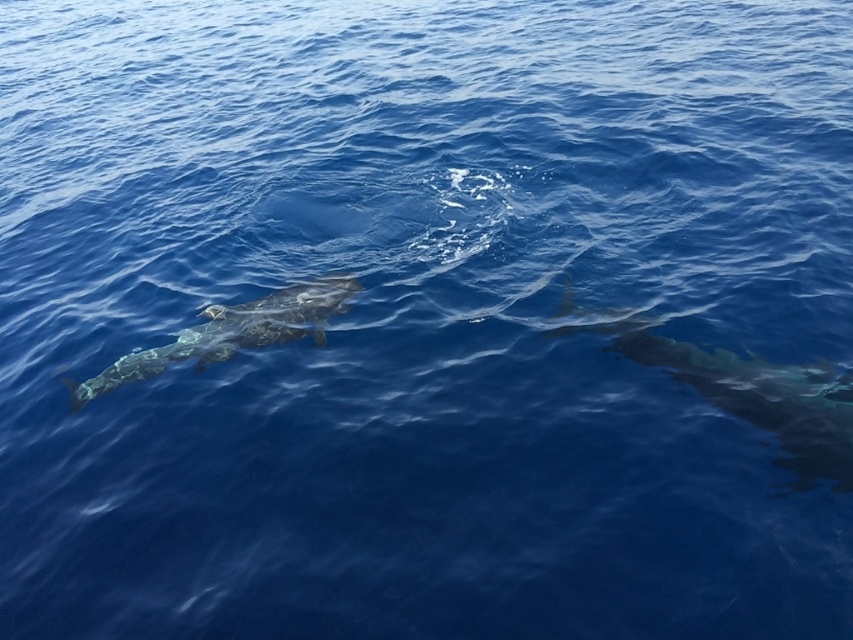
Is shiny dark gray whale at right to the left of smooth gray whale at left from the viewer's perspective?

Result: No, shiny dark gray whale at right is not to the left of smooth gray whale at left.

Between point (670, 355) and point (74, 394), which one is positioned behind?

Positioned behind is point (74, 394).

Where is `shiny dark gray whale at right`? The width and height of the screenshot is (853, 640). shiny dark gray whale at right is located at coordinates (753, 396).